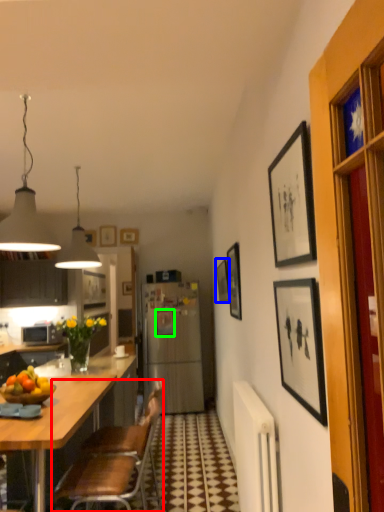
Question: Which object is positioned farthest from chair (highlighted by a red box)? Select from picture frame (highlighted by a blue box) and picture frame (highlighted by a green box).

Choices:
 (A) picture frame
 (B) picture frame

Answer: (B)